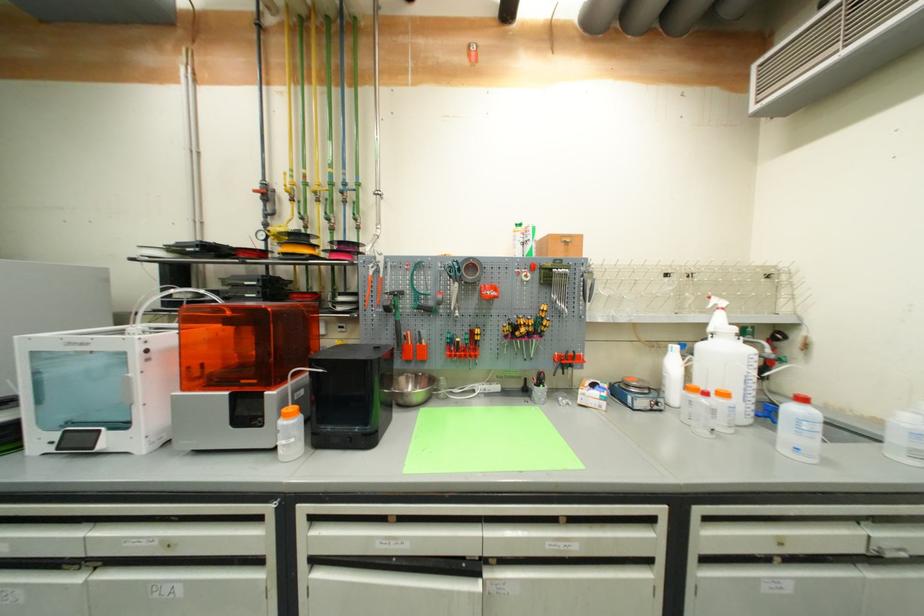
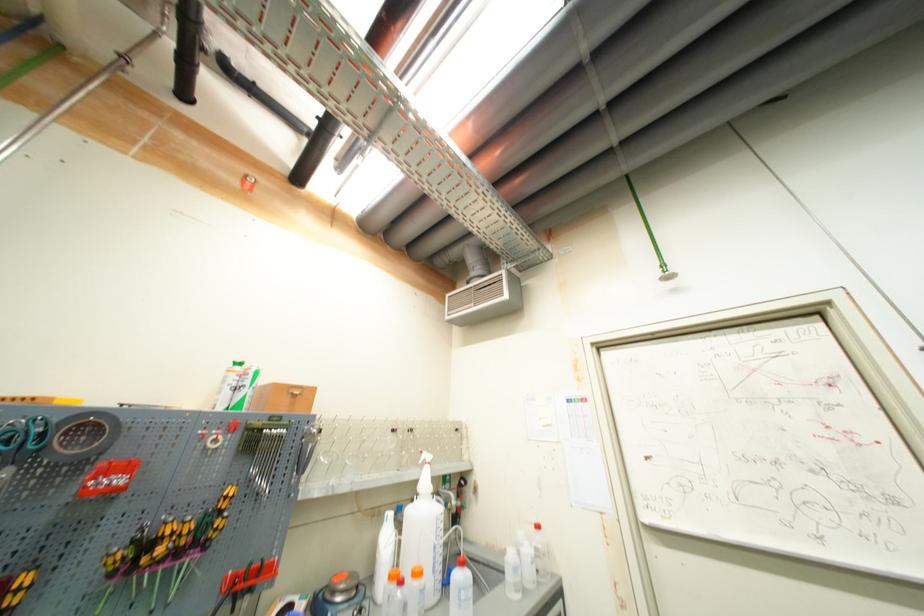
In the second image, find the point that corresponds to (x=628, y=379) in the first image.

(335, 582)